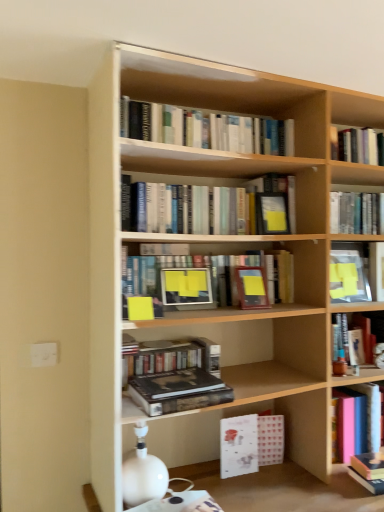
Measure the distance between matte black paperback book at upper center, acting as the 2th paperback book starting from the front, and camera.

matte black paperback book at upper center, acting as the 2th paperback book starting from the front, and camera are 5.37 feet apart.

This screenshot has width=384, height=512. Describe the element at coordinates (369, 331) in the screenshot. I see `hardcover book at right, the sixth book in the top-to-bottom sequence` at that location.

Image resolution: width=384 pixels, height=512 pixels. What do you see at coordinates (203, 209) in the screenshot?
I see `hardcover books at upper center, the 3th book viewed from the top` at bounding box center [203, 209].

Image resolution: width=384 pixels, height=512 pixels. What do you see at coordinates (348, 274) in the screenshot?
I see `translucent plastic book at upper right, the fifth book positioned from the bottom` at bounding box center [348, 274].

In the scene shown: In order to face hardcover book at upper right, arranged as the 8th book when ordered from the bottom, should I rotate leftwards or rightwards?

Rotate your view right by about 21.869°.

Find the location of a particular element. Image resolution: width=384 pixels, height=512 pixels. light wood bookcase at center is located at coordinates (222, 255).

Is translucent plastic book at upper right, the fifth book positioned from the bottom, at the left side of hardcover book at center, which is the first paperback book from bottom to top?

No, translucent plastic book at upper right, the fifth book positioned from the bottom, is not to the left of hardcover book at center, which is the first paperback book from bottom to top.

Is translucent plastic book at upper right, the fifth book positioned from the bottom, completely or partially outside of hardcover book at center, which is the first paperback book from bottom to top?

Absolutely, translucent plastic book at upper right, the fifth book positioned from the bottom, is external to hardcover book at center, which is the first paperback book from bottom to top.

Does translucent plastic book at upper right, the fifth book positioned from the bottom, have a lesser width compared to hardcover book at center, which is counted as the 1th paperback book, starting from the front?

Indeed, translucent plastic book at upper right, the fifth book positioned from the bottom, has a lesser width compared to hardcover book at center, which is counted as the 1th paperback book, starting from the front.

Does point (333, 303) appear closer or farther from the camera than point (165, 385)?

Point (333, 303) is farther from the camera than point (165, 385).

Considering the positions of objects pink matte book at right, the 1th book when ordered from bottom to top, and hardcover book at center, the 1th paperback book in the left-to-right sequence, in the image provided, who is in front, pink matte book at right, the 1th book when ordered from bottom to top, or hardcover book at center, the 1th paperback book in the left-to-right sequence,?

hardcover book at center, the 1th paperback book in the left-to-right sequence, is in front.

From a real-world perspective, relative to hardcover book at center, the 2th paperback book positioned from the top, is pink matte book at right, the 1th book when ordered from bottom to top, vertically above or below?

pink matte book at right, the 1th book when ordered from bottom to top, is situated lower than hardcover book at center, the 2th paperback book positioned from the top, in the real world.

From the image's perspective, who appears lower, pink matte book at right, the 8th book in the top-to-bottom sequence, or hardcover book at center, which is counted as the second paperback book, starting from the back?

pink matte book at right, the 8th book in the top-to-bottom sequence, is shown below in the image.

Does pink matte book at right, the 8th book in the top-to-bottom sequence, turn towards hardcover book at center, which is counted as the second paperback book, starting from the back?

No, pink matte book at right, the 8th book in the top-to-bottom sequence, is not aimed at hardcover book at center, which is counted as the second paperback book, starting from the back.

Is translucent plastic book at upper right, which is the 4th book in top-to-bottom order, surrounding hardcover book at upper center, which is the second book in top-to-bottom order?

No, hardcover book at upper center, which is the second book in top-to-bottom order, is not surrounded by translucent plastic book at upper right, which is the 4th book in top-to-bottom order.

Which object is more forward, translucent plastic book at upper right, which is the 4th book in top-to-bottom order, or hardcover book at upper center, the seventh book from the bottom?

translucent plastic book at upper right, which is the 4th book in top-to-bottom order.

Is translucent plastic book at upper right, which is the 4th book in top-to-bottom order, to the left or to the right of hardcover book at upper center, which is the second book in top-to-bottom order, in the image?

translucent plastic book at upper right, which is the 4th book in top-to-bottom order, is positioned on hardcover book at upper center, which is the second book in top-to-bottom order,'s left side.

Measure the distance between translucent plastic book at upper right, the fifth book positioned from the bottom, and hardcover book at upper center, which is the second book in top-to-bottom order.

translucent plastic book at upper right, the fifth book positioned from the bottom, and hardcover book at upper center, which is the second book in top-to-bottom order, are 6.08 inches apart from each other.

From a real-world perspective, which object rests below the other?

From a 3D spatial view, translucent plastic book at upper right, the fifth book positioned from the bottom, is below.

Is hardcover book at upper center, the seventh book from the bottom, facing away from translucent plastic book at upper right, the fifth book positioned from the bottom?

hardcover book at upper center, the seventh book from the bottom, does not have its back to translucent plastic book at upper right, the fifth book positioned from the bottom.

Between hardcover book at upper center, which is the second book in top-to-bottom order, and translucent plastic book at upper right, which is the 4th book in top-to-bottom order, which one appears on the left side from the viewer's perspective?

From the viewer's perspective, translucent plastic book at upper right, which is the 4th book in top-to-bottom order, appears more on the left side.

Is point (379, 224) closer to camera compared to point (336, 264)?

That is True.

Is hardcover books at center, which is counted as the seventh book, starting from the top, not inside matte wooden frame at center, which appears as the fourth book when ordered from the bottom?

hardcover books at center, which is counted as the seventh book, starting from the top, lies outside matte wooden frame at center, which appears as the fourth book when ordered from the bottom,'s area.

Which point is more distant from viewer, (x=185, y=353) or (x=166, y=296)?

The point (x=185, y=353) is more distant.

From the image's perspective, which one is positioned lower, hardcover books at center, the second book from the bottom, or matte wooden frame at center, the 5th book in the top-to-bottom sequence?

From the image's view, hardcover books at center, the second book from the bottom, is below.

Considering the positions of objects hardcover books at center, which is counted as the seventh book, starting from the top, and matte wooden frame at center, the 5th book in the top-to-bottom sequence, in the image provided, who is more to the left, hardcover books at center, which is counted as the seventh book, starting from the top, or matte wooden frame at center, the 5th book in the top-to-bottom sequence,?

hardcover books at center, which is counted as the seventh book, starting from the top.

Would you consider hardcover book at upper center, the seventh book from the bottom, to be distant from hardcover books at center, the second book from the bottom?

Actually, hardcover book at upper center, the seventh book from the bottom, and hardcover books at center, the second book from the bottom, are a little close together.

Does hardcover book at upper center, which is the second book in top-to-bottom order, appear on the left side of hardcover books at center, the second book from the bottom?

In fact, hardcover book at upper center, which is the second book in top-to-bottom order, is to the right of hardcover books at center, the second book from the bottom.

Does point (348, 196) come in front of point (133, 356)?

That is False.

From a real-world perspective, is matte black paperback book at upper center, which ranks as the 2th paperback book in left-to-right order, positioned above or below hardcover book at upper right, the 1th book viewed from the top?

Clearly, from a real-world perspective, matte black paperback book at upper center, which ranks as the 2th paperback book in left-to-right order, is below hardcover book at upper right, the 1th book viewed from the top.

From a real-world perspective, which paperback book is the 1st one underneath the hardcover book at upper right, arranged as the 8th book when ordered from the bottom? Please provide its 2D coordinates.

[(272, 213)]

Could you tell me if matte black paperback book at upper center, which is the 1th paperback book from top to bottom, is turned towards hardcover book at upper right, arranged as the 8th book when ordered from the bottom?

No, matte black paperback book at upper center, which is the 1th paperback book from top to bottom, does not turn towards hardcover book at upper right, arranged as the 8th book when ordered from the bottom.

Is matte black paperback book at upper center, arranged as the 2th paperback book when ordered from the bottom, to the right of hardcover book at upper right, the 1th book viewed from the top, from the viewer's perspective?

In fact, matte black paperback book at upper center, arranged as the 2th paperback book when ordered from the bottom, is to the left of hardcover book at upper right, the 1th book viewed from the top.

The image size is (384, 512). In order to click on paperback book that appears below the translucent plastic book at upper right, which is the 4th book in top-to-bottom order (from a real-world perspective) in this screenshot , I will do `click(176, 384)`.

Where is `paperback book that is the 1st object above the pink matte book at right, the 8th book in the top-to-bottom sequence (from a real-world perspective)`? This screenshot has height=512, width=384. paperback book that is the 1st object above the pink matte book at right, the 8th book in the top-to-bottom sequence (from a real-world perspective) is located at coordinates (176, 384).

Estimate the real-world distances between objects in this image. Which object is further from hardcover books at upper center, placed as the 6th book when sorted from bottom to top, pink matte book at right, the 1th book when ordered from bottom to top, or light wood bookcase at center?

Among the two, pink matte book at right, the 1th book when ordered from bottom to top, is located further to hardcover books at upper center, placed as the 6th book when sorted from bottom to top.

Based on their spatial positions, is hardcover books at upper center, placed as the 6th book when sorted from bottom to top, or matte wooden frame at center, the 5th book in the top-to-bottom sequence, further from pink matte book at right, the 1th book when ordered from bottom to top?

hardcover books at upper center, placed as the 6th book when sorted from bottom to top, is positioned further to the anchor pink matte book at right, the 1th book when ordered from bottom to top.

When comparing their distances from light wood bookcase at center, does hardcover books at upper center, placed as the 6th book when sorted from bottom to top, or matte wooden frame at center, which appears as the fourth book when ordered from the bottom, seem further?

The object further to light wood bookcase at center is matte wooden frame at center, which appears as the fourth book when ordered from the bottom.

Based on their spatial positions, is matte wooden frame at center, the 5th book in the top-to-bottom sequence, or hardcover books at center, the second book from the bottom, further from pink matte book at right, the 8th book in the top-to-bottom sequence?

matte wooden frame at center, the 5th book in the top-to-bottom sequence.

Consider the image. From the image, which object appears to be nearer to hardcover book at upper center, which is the second book in top-to-bottom order, matte black paperback book at upper center, which is the 1th paperback book from top to bottom, or hardcover books at upper center, placed as the 6th book when sorted from bottom to top?

matte black paperback book at upper center, which is the 1th paperback book from top to bottom.

Estimate the real-world distances between objects in this image. Which object is closer to translucent plastic book at upper right, which is the 4th book in top-to-bottom order, hardcover books at upper center, placed as the 6th book when sorted from bottom to top, or light wood bookcase at center?

Based on the image, hardcover books at upper center, placed as the 6th book when sorted from bottom to top, appears to be nearer to translucent plastic book at upper right, which is the 4th book in top-to-bottom order.

Based on their spatial positions, is pink matte book at right, the 1th book when ordered from bottom to top, or matte black paperback book at upper center, arranged as the 2th paperback book when ordered from the bottom, closer to hardcover book at center, which is the first paperback book from bottom to top?

matte black paperback book at upper center, arranged as the 2th paperback book when ordered from the bottom, is closer to hardcover book at center, which is the first paperback book from bottom to top.

When comparing their distances from matte wooden frame at center, the 5th book in the top-to-bottom sequence, does hardcover book at upper right, arranged as the 8th book when ordered from the bottom, or translucent plastic book at upper right, which is the 4th book in top-to-bottom order, seem closer?

translucent plastic book at upper right, which is the 4th book in top-to-bottom order, lies closer to matte wooden frame at center, the 5th book in the top-to-bottom sequence, than the other object.

The height and width of the screenshot is (512, 384). What are the coordinates of `bookcase that lies between hardcover book at upper right, arranged as the 8th book when ordered from the bottom, and hardcover book at right, the sixth book in the top-to-bottom sequence, from top to bottom` in the screenshot? It's located at (222, 255).

You are a GUI agent. You are given a task and a screenshot of the screen. Output one action in this format:
    pyautogui.click(x=<x>, y=<y>)
    Task: Click on the paperback book located between hardcover books at upper center, the 3th book viewed from the top, and hardcover book at upper right, the 1th book viewed from the top, in the left-right direction
    The width and height of the screenshot is (384, 512).
    Given the screenshot: What is the action you would take?
    pyautogui.click(x=272, y=213)

Find the location of `bookcase between hardcover books at upper center, placed as the 6th book when sorted from bottom to top, and hardcover books at center, the second book from the bottom, in the vertical direction`. bookcase between hardcover books at upper center, placed as the 6th book when sorted from bottom to top, and hardcover books at center, the second book from the bottom, in the vertical direction is located at coordinates (222, 255).

Locate an element on the screen. book located between matte wooden frame at center, which appears as the fourth book when ordered from the bottom, and hardcover book at right, the sixth book in the top-to-bottom sequence, in the left-right direction is located at coordinates 348,274.